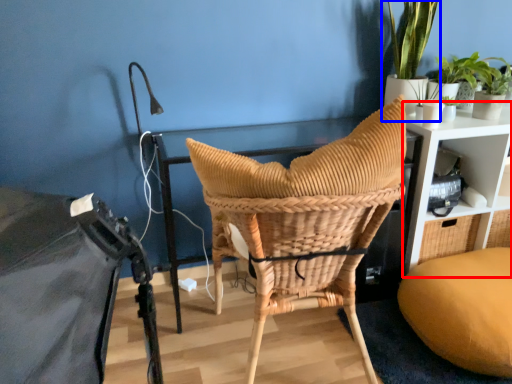
Question: Which object appears closest to the camera in this image, shelf (highlighted by a red box) or houseplant (highlighted by a blue box)?

Choices:
 (A) shelf
 (B) houseplant

Answer: (B)